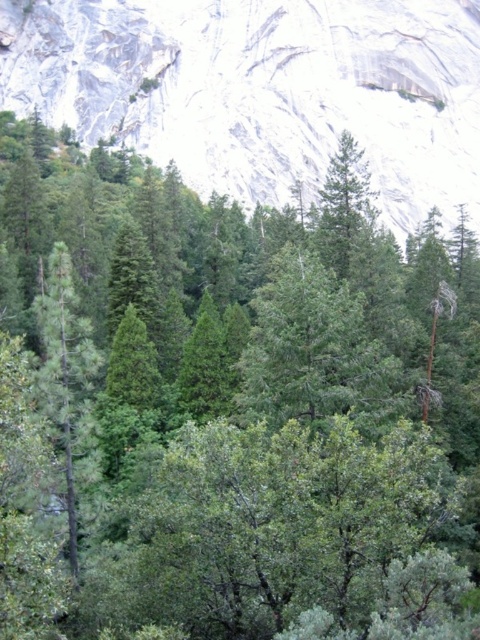
Question: Where is white rock at upper center located in relation to green matte tree at left in the image?

Choices:
 (A) below
 (B) above

Answer: (B)

Question: Which point appears closest to the camera in this image?

Choices:
 (A) (68, 257)
 (B) (296, 120)

Answer: (A)

Question: Does white rock at upper center appear over green matte tree at left?

Choices:
 (A) no
 (B) yes

Answer: (B)

Question: Is white rock at upper center above green matte tree at left?

Choices:
 (A) yes
 (B) no

Answer: (A)

Question: Which of the following is the closest to the observer?

Choices:
 (A) (49, 323)
 (B) (208, 132)

Answer: (A)